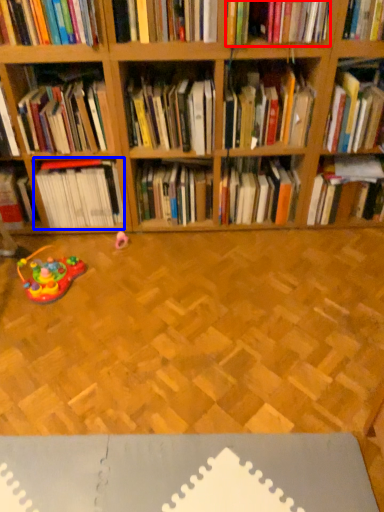
Question: Which object appears farthest to the camera in this image, book (highlighted by a red box) or book (highlighted by a blue box)?

Choices:
 (A) book
 (B) book

Answer: (B)